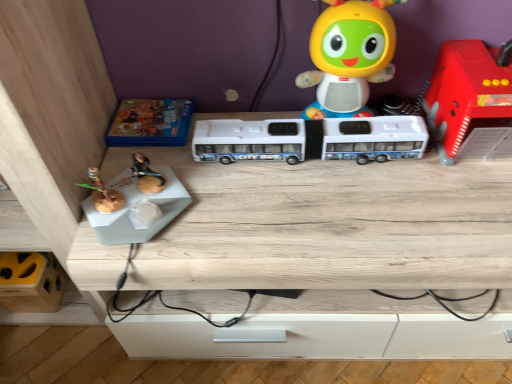
Locate an element on the screen. Image resolution: width=512 pixels, height=384 pixels. vacant space in front of matte plastic toy at upper center, marked as the fourth toy in a left-to-right arrangement is located at coordinates (357, 190).